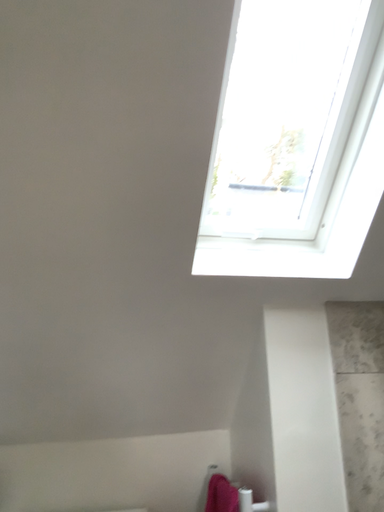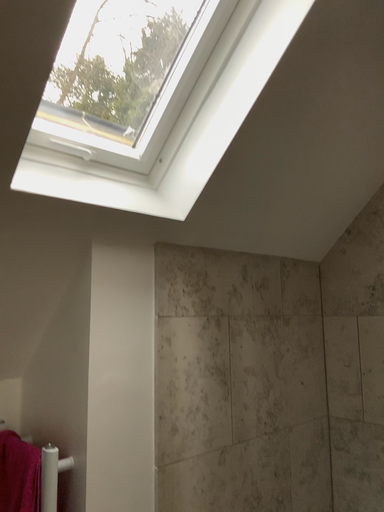
Question: How did the camera likely rotate when shooting the video?

Choices:
 (A) rotated right
 (B) rotated left

Answer: (A)